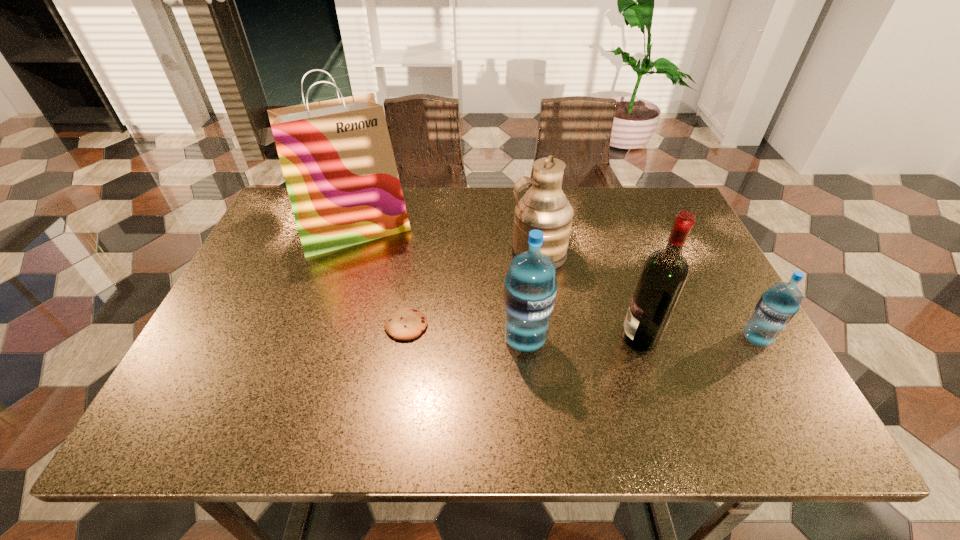
The width and height of the screenshot is (960, 540). Find the location of `free space between the shorter water bottle and the alcohol`. free space between the shorter water bottle and the alcohol is located at coordinates (698, 338).

This screenshot has height=540, width=960. Identify the location of free spot between the cookie and the pitcher. (472, 290).

At what (x,y) coordinates should I click in order to perform the action: click on vacant area that lies between the shortest object and the second shortest object. Please return your answer as a coordinate pair (x, y). Image resolution: width=960 pixels, height=540 pixels. Looking at the image, I should click on (581, 332).

This screenshot has height=540, width=960. In order to click on vacant area that lies between the left water bottle and the shortest object in this screenshot , I will do `click(466, 333)`.

The width and height of the screenshot is (960, 540). Identify the location of the fifth closest object to the right water bottle. (336, 155).

The image size is (960, 540). I want to click on object that is the second closest to the alcohol, so click(x=776, y=308).

Locate an element on the screen. This screenshot has height=540, width=960. free point that satisfies the following two spatial constraints: 1. on the back side of the rightmost object; 2. on the right side of the left water bottle is located at coordinates (525, 339).

At what (x,y) coordinates should I click in order to perform the action: click on vacant region that satisfies the following two spatial constraints: 1. on the front side of the shopping bag; 2. on the right side of the taller water bottle. Please return your answer as a coordinate pair (x, y). Looking at the image, I should click on (319, 340).

At what (x,y) coordinates should I click in order to perform the action: click on vacant space that satisfies the following two spatial constraints: 1. on the front side of the shortest object; 2. on the left side of the taller water bottle. Please return your answer as a coordinate pair (x, y). Looking at the image, I should click on (404, 340).